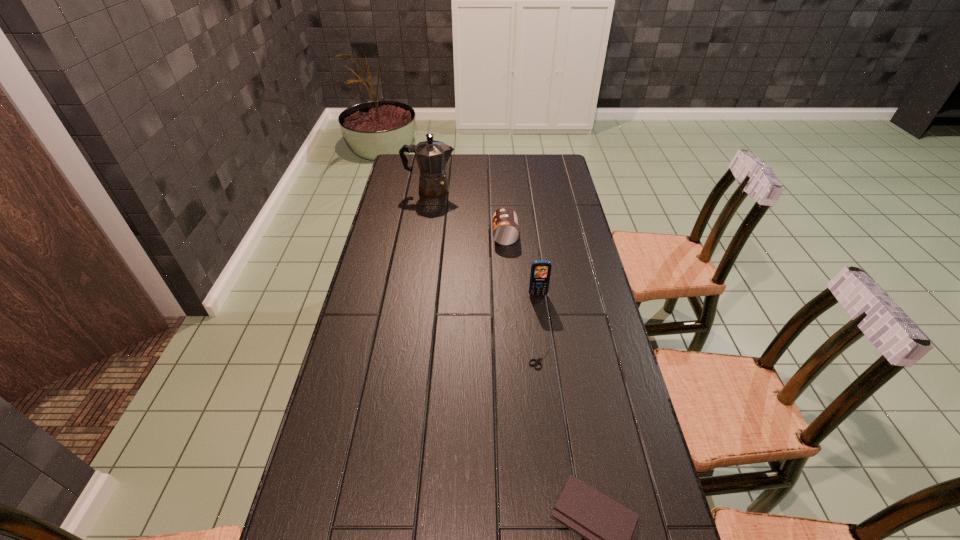
The height and width of the screenshot is (540, 960). In order to click on vacant region between the third farthest object and the third tallest object in this screenshot , I will do `click(521, 265)`.

Where is `unoccupied area between the coffeepot and the shortest object`? The height and width of the screenshot is (540, 960). unoccupied area between the coffeepot and the shortest object is located at coordinates (487, 273).

Find the location of a particular element. The width and height of the screenshot is (960, 540). vacant space in between the farthest object and the shears is located at coordinates (487, 273).

Find the location of `vacant area that lies between the cellular telephone and the shortest object`. vacant area that lies between the cellular telephone and the shortest object is located at coordinates (540, 326).

You are a GUI agent. You are given a task and a screenshot of the screen. Output one action in this format:
    pyautogui.click(x=<x>, y=<y>)
    Task: Click on the vacant region between the tallest object and the third tallest object
    The width and height of the screenshot is (960, 540).
    Given the screenshot: What is the action you would take?
    pyautogui.click(x=468, y=213)

Where is `free space between the tallest object and the fourth shortest object`? free space between the tallest object and the fourth shortest object is located at coordinates (484, 242).

You are a GUI agent. You are given a task and a screenshot of the screen. Output one action in this format:
    pyautogui.click(x=<x>, y=<y>)
    Task: Click on the second closest object to the fourth tallest object
    This screenshot has height=540, width=960.
    Given the screenshot: What is the action you would take?
    pyautogui.click(x=540, y=272)

Choose which object is the third nearest neighbor to the shortest object. Please provide its 2D coordinates. Your answer should be formatted as a tuple, i.e. [(x, y)], where the tuple contains the x and y coordinates of a point satisfying the conditions above.

[(505, 224)]

The image size is (960, 540). What are the coordinates of `free space that satisfies the following two spatial constraints: 1. on the pouring side of the leftmost object; 2. on the left side of the shortest object` in the screenshot? It's located at (405, 357).

Find the location of a particular element. free location that satisfies the following two spatial constraints: 1. on the front label of the shortest object; 2. on the right side of the third shortest object is located at coordinates pos(514,357).